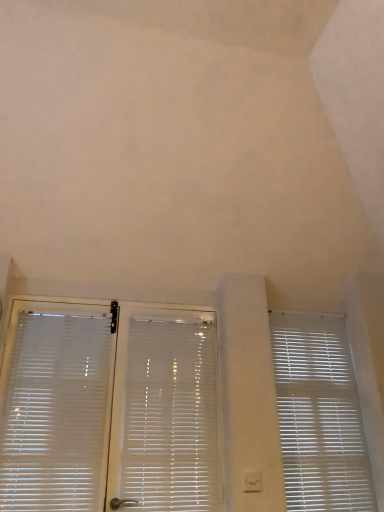
Question: Visually, is white plastic blinds at center, which appears as the second window blind when viewed from the left, positioned to the left or to the right of white plastic window blind at right, the third window blind in the left-to-right sequence?

Choices:
 (A) right
 (B) left

Answer: (B)

Question: Relative to white plastic window blind at right, the first window blind from the right, is white plastic blinds at center, which is the second window blind in right-to-left order, in front or behind?

Choices:
 (A) front
 (B) behind

Answer: (A)

Question: Considering the real-world distances, which object is farthest from the white plastic window blind at right, the first window blind from the right?

Choices:
 (A) white plastic blinds at center, which is the second window blind in right-to-left order
 (B) white translucent blinds at left, placed as the 3th window blind when sorted from right to left

Answer: (B)

Question: Which is farther from the white translucent blinds at left, placed as the 1th window blind when sorted from left to right?

Choices:
 (A) white plastic window blind at right, the third window blind in the left-to-right sequence
 (B) white plastic blinds at center, which is the second window blind in right-to-left order

Answer: (A)